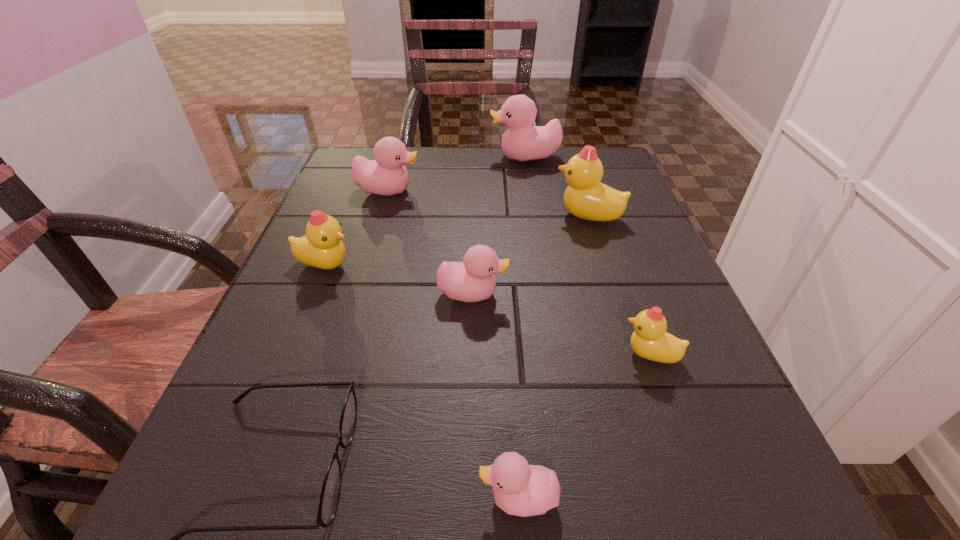
Find the location of a particular element. vacant space located on the front-facing side of the second farthest duckling is located at coordinates coord(585,191).

You are a GUI agent. You are given a task and a screenshot of the screen. Output one action in this format:
    pyautogui.click(x=<x>, y=<y>)
    Task: Click on the vacant space located 0.320m on the front-facing side of the fifth nearest object
    The width and height of the screenshot is (960, 540).
    Given the screenshot: What is the action you would take?
    pyautogui.click(x=531, y=265)

Identify the location of free region located on the front-facing side of the second smallest pink duckling. [x=595, y=294].

Identify the location of vacant point located on the front-facing side of the sixth farthest object. The image size is (960, 540). (434, 354).

Locate an element on the screen. Image resolution: width=960 pixels, height=540 pixels. vacant space located on the front-facing side of the sixth farthest object is located at coordinates (568, 354).

Where is `vacant area situated on the front-facing side of the sixth farthest object`? The height and width of the screenshot is (540, 960). vacant area situated on the front-facing side of the sixth farthest object is located at coordinates (568, 354).

Locate an element on the screen. This screenshot has width=960, height=540. free space located 0.300m on the front-facing side of the shortest duckling is located at coordinates (217, 498).

This screenshot has width=960, height=540. I want to click on vacant space located 0.290m on the front-facing side of the shortest duckling, so click(x=226, y=498).

Where is `vacant space located on the front-facing side of the shortest duckling`? The height and width of the screenshot is (540, 960). vacant space located on the front-facing side of the shortest duckling is located at coordinates (339, 498).

Find the location of a particular element. The height and width of the screenshot is (540, 960). object that is at the near edge is located at coordinates (520, 489).